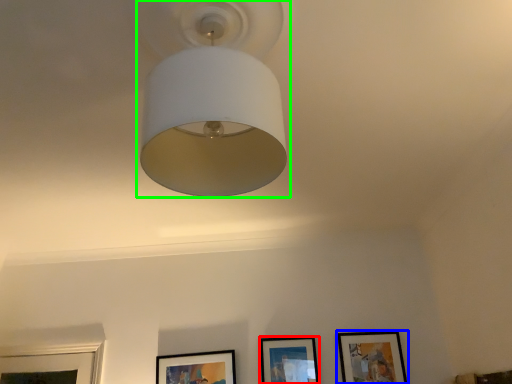
Question: Considering the real-world distances, which object is farthest from picture frame (highlighted by a red box)? picture frame (highlighted by a blue box) or lamp (highlighted by a green box)?

Choices:
 (A) picture frame
 (B) lamp

Answer: (B)